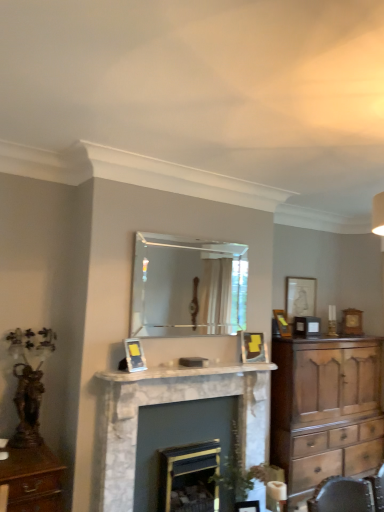
Question: Does white marble fireplace mantel at center appear on the right side of marble fireplace at center, the second fireplace in the right-to-left sequence?

Choices:
 (A) no
 (B) yes

Answer: (B)

Question: Would you say white marble fireplace mantel at center contains marble fireplace at center, acting as the 1th fireplace starting from the left?

Choices:
 (A) yes
 (B) no

Answer: (B)

Question: Can you confirm if white marble fireplace mantel at center is bigger than marble fireplace at center, acting as the 1th fireplace starting from the left?

Choices:
 (A) yes
 (B) no

Answer: (B)

Question: Is white marble fireplace mantel at center further to camera compared to marble fireplace at center, acting as the 1th fireplace starting from the left?

Choices:
 (A) no
 (B) yes

Answer: (B)

Question: Is white marble fireplace mantel at center next to marble fireplace at center, acting as the 1th fireplace starting from the left?

Choices:
 (A) yes
 (B) no

Answer: (B)

Question: Based on their sizes in the image, would you say matte silver picture frame at upper right, the 1th picture frame viewed from the back, is bigger or smaller than matte gold picture frame at upper center, the third picture frame from the right?

Choices:
 (A) big
 (B) small

Answer: (A)

Question: Visually, is matte silver picture frame at upper right, marked as the 4th picture frame in a front-to-back arrangement, positioned to the left or to the right of matte gold picture frame at upper center, marked as the second picture frame in a front-to-back arrangement?

Choices:
 (A) left
 (B) right

Answer: (B)

Question: From a real-world perspective, is matte silver picture frame at upper right, marked as the 4th picture frame in a front-to-back arrangement, above or below matte gold picture frame at upper center, the 3th picture frame from the back?

Choices:
 (A) below
 (B) above

Answer: (B)

Question: Considering the positions of point (299, 293) and point (249, 361), is point (299, 293) closer or farther from the camera than point (249, 361)?

Choices:
 (A) closer
 (B) farther

Answer: (B)

Question: From their relative heights in the image, would you say dark gray marble fireplace at center, arranged as the 2th fireplace when viewed from the left, is taller or shorter than matte silver picture frame at upper right, which is counted as the fourth picture frame, starting from the left?

Choices:
 (A) tall
 (B) short

Answer: (A)

Question: Looking at the image, does dark gray marble fireplace at center, which appears as the first fireplace when viewed from the right, seem bigger or smaller compared to matte silver picture frame at upper right, marked as the 4th picture frame in a front-to-back arrangement?

Choices:
 (A) big
 (B) small

Answer: (A)

Question: From the image's perspective, is dark gray marble fireplace at center, which appears as the first fireplace when viewed from the right, positioned above or below matte silver picture frame at upper right, which is counted as the fourth picture frame, starting from the left?

Choices:
 (A) below
 (B) above

Answer: (A)

Question: Which is correct: dark gray marble fireplace at center, arranged as the 2th fireplace when viewed from the left, is inside matte silver picture frame at upper right, which is counted as the fourth picture frame, starting from the left, or outside of it?

Choices:
 (A) inside
 (B) outside

Answer: (B)

Question: From their relative heights in the image, would you say clear glass mirror at center is taller or shorter than marble fireplace at center, acting as the 1th fireplace starting from the left?

Choices:
 (A) short
 (B) tall

Answer: (A)

Question: From the image's perspective, is clear glass mirror at center above or below marble fireplace at center, acting as the 1th fireplace starting from the left?

Choices:
 (A) below
 (B) above

Answer: (B)